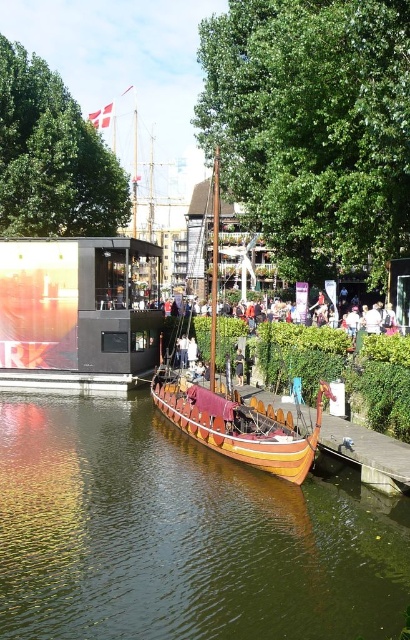
Can you confirm if brown wooden boat at center is shorter than wooden polished boat at center?

Yes, brown wooden boat at center is shorter than wooden polished boat at center.

Which of these two, brown wooden boat at center or wooden polished boat at center, stands shorter?

brown wooden boat at center

Image resolution: width=410 pixels, height=640 pixels. What do you see at coordinates (182, 536) in the screenshot? I see `brown wooden boat at center` at bounding box center [182, 536].

This screenshot has height=640, width=410. Identify the location of brown wooden boat at center. (182, 536).